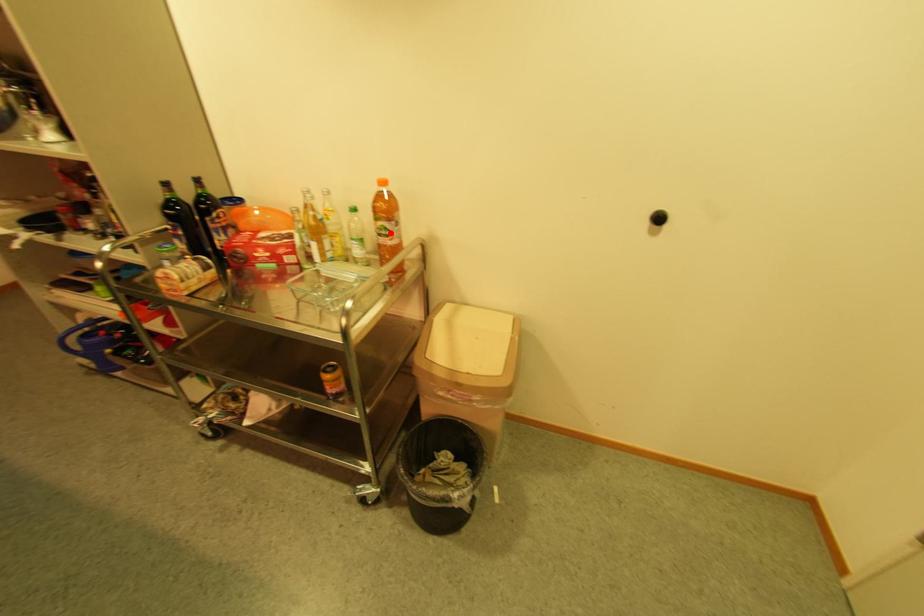
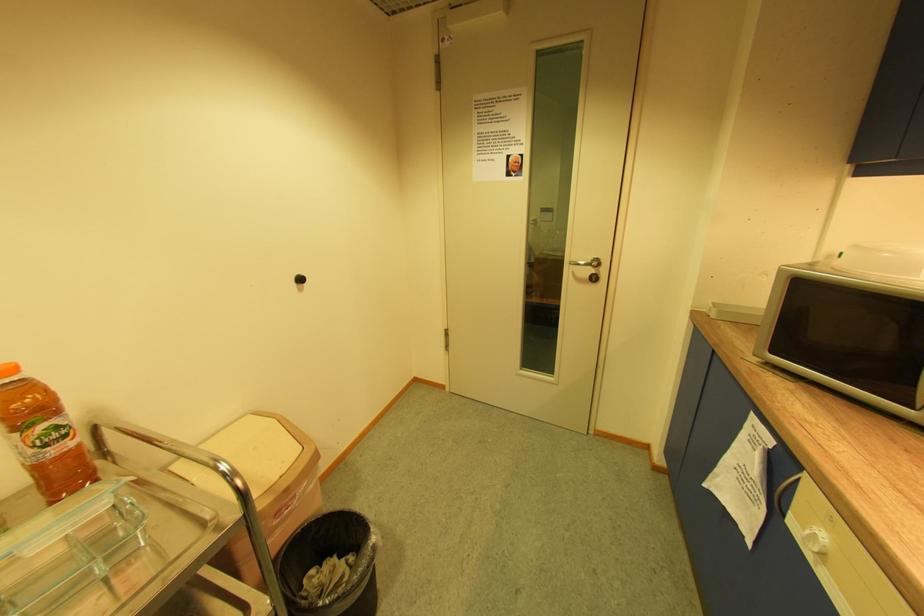
In the second image, find the point that corresponds to the highlighted location in the first image.

(61, 437)